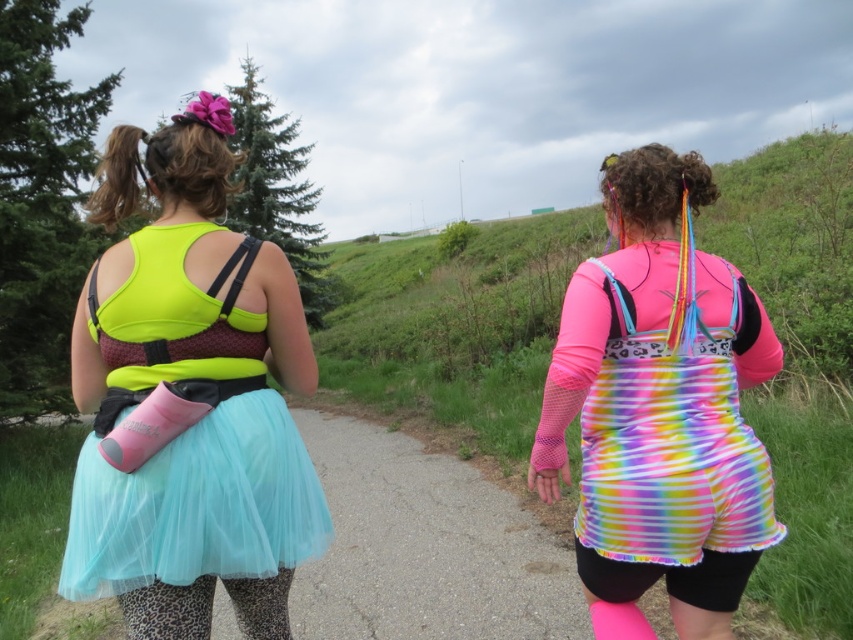
Which of these two, light blue tulle skirt at center or leopard print leggings at lower center, stands shorter?

leopard print leggings at lower center

Does light blue tulle skirt at center have a larger size compared to leopard print leggings at lower center?

Yes.

Is point (164, 525) behind point (135, 593)?

No.

Find the location of a particular element. The width and height of the screenshot is (853, 640). light blue tulle skirt at center is located at coordinates (196, 506).

Between neon green fabric tank top at upper left and light blue tulle skirt at center, which one is positioned lower?

light blue tulle skirt at center is lower down.

Between neon green fabric tank top at upper left and light blue tulle skirt at center, which one is positioned higher?

neon green fabric tank top at upper left

Identify the location of neon green fabric tank top at upper left. This screenshot has width=853, height=640. (189, 400).

Consider the image. Is rainbow tie-dye shorts at center closer to the viewer compared to leopard print leggings at lower center?

No, rainbow tie-dye shorts at center is further to the viewer.

How much distance is there between rainbow tie-dye shorts at center and leopard print leggings at lower center?

rainbow tie-dye shorts at center is 29.98 inches from leopard print leggings at lower center.

Locate an element on the screen. The height and width of the screenshot is (640, 853). rainbow tie-dye shorts at center is located at coordinates (660, 404).